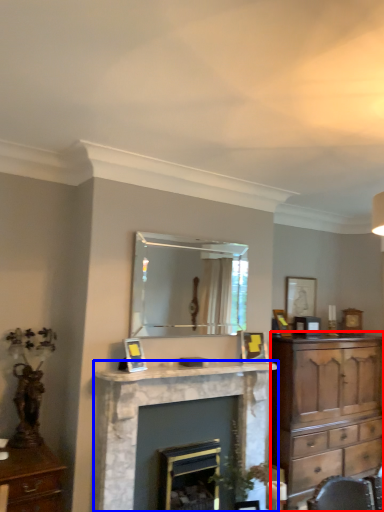
Question: Among these objects, which one is farthest to the camera, chest of drawers (highlighted by a red box) or fireplace (highlighted by a blue box)?

Choices:
 (A) chest of drawers
 (B) fireplace

Answer: (A)